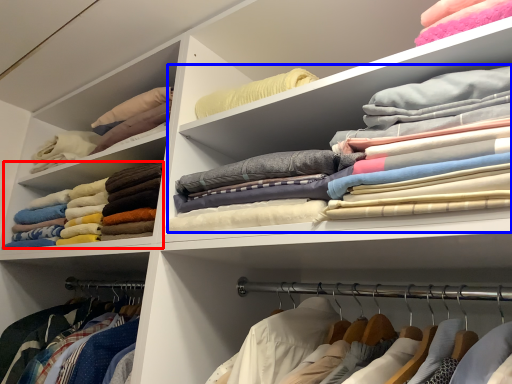
Question: Which point is further to the camera, clothing (highlighted by a red box) or clothing (highlighted by a blue box)?

Choices:
 (A) clothing
 (B) clothing

Answer: (A)